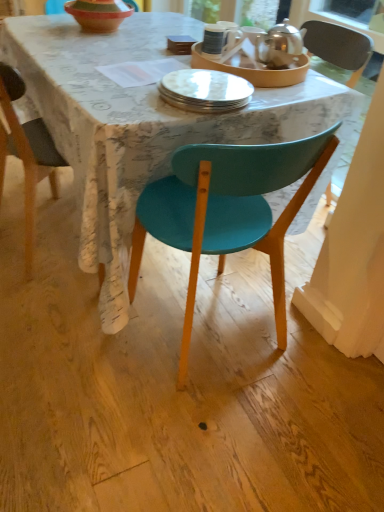
Locate an element on the screen. The height and width of the screenshot is (512, 384). vacant region to the right of white glossy plate at center is located at coordinates (284, 99).